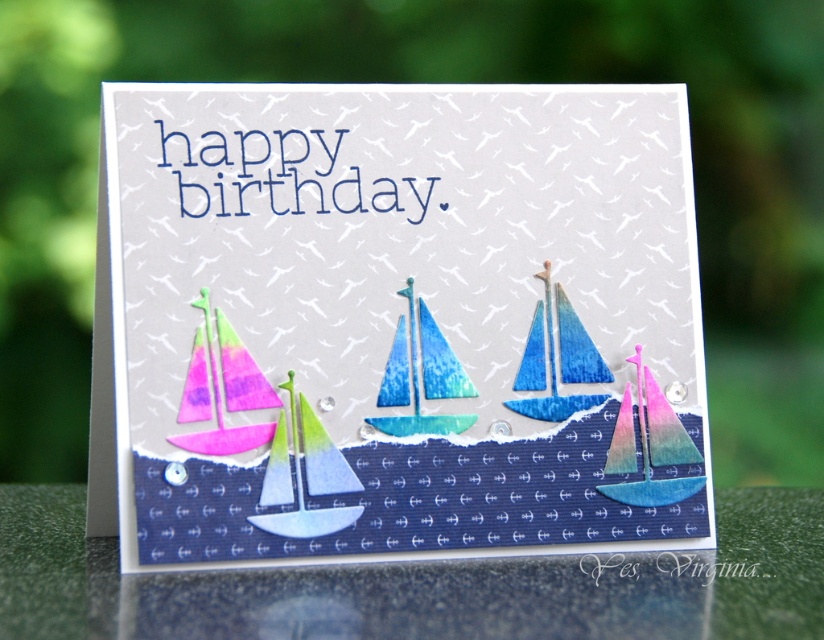
Is pink holographic sailboat at center shorter than pink glossy sailboat at lower left?

Yes, pink holographic sailboat at center is shorter than pink glossy sailboat at lower left.

Is pink holographic sailboat at center taller than pink glossy sailboat at lower left?

Incorrect, pink holographic sailboat at center's height is not larger of pink glossy sailboat at lower left's.

What do you see at coordinates (658, 448) in the screenshot?
I see `pink holographic sailboat at center` at bounding box center [658, 448].

Find the location of a particular element. pink holographic sailboat at center is located at coordinates (658, 448).

Does watercolor sailboats at lower center have a lesser height compared to watercolor sailboat at left?

In fact, watercolor sailboats at lower center may be taller than watercolor sailboat at left.

Does watercolor sailboats at lower center have a smaller size compared to watercolor sailboat at left?

No, watercolor sailboats at lower center is not smaller than watercolor sailboat at left.

Between point (146, 196) and point (195, 356), which one is positioned in front?

Point (195, 356)

Identify the location of watercolor sailboats at lower center. (401, 323).

Can you confirm if navy blue paper boat at lower center is shorter than blue gradient paper sailboat at center?

Yes.

Between navy blue paper boat at lower center and blue gradient paper sailboat at center, which one has less height?

With less height is navy blue paper boat at lower center.

Does point (329, 592) come closer to viewer compared to point (567, 356)?

Yes, point (329, 592) is in front of point (567, 356).

Find the location of a particular element. This screenshot has height=640, width=824. navy blue paper boat at lower center is located at coordinates (420, 584).